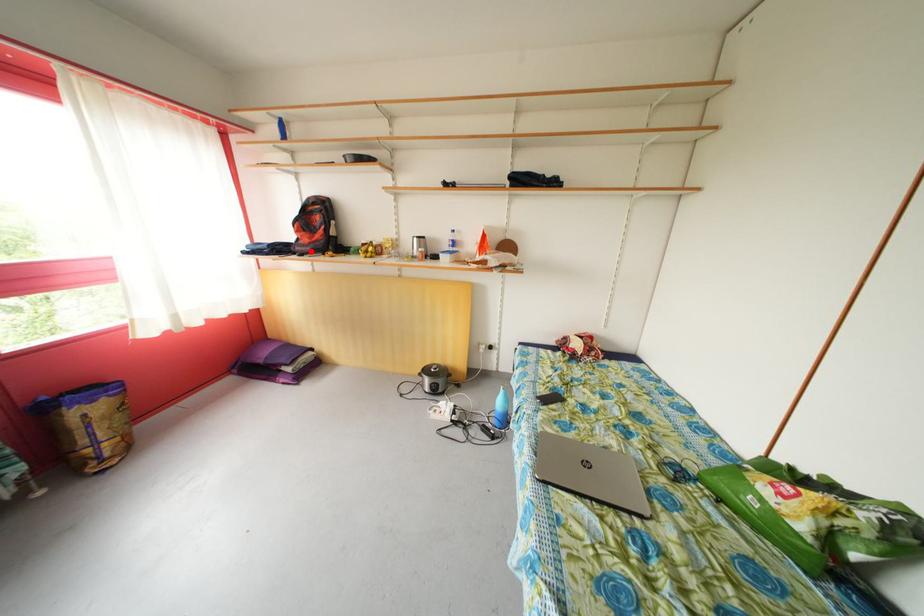
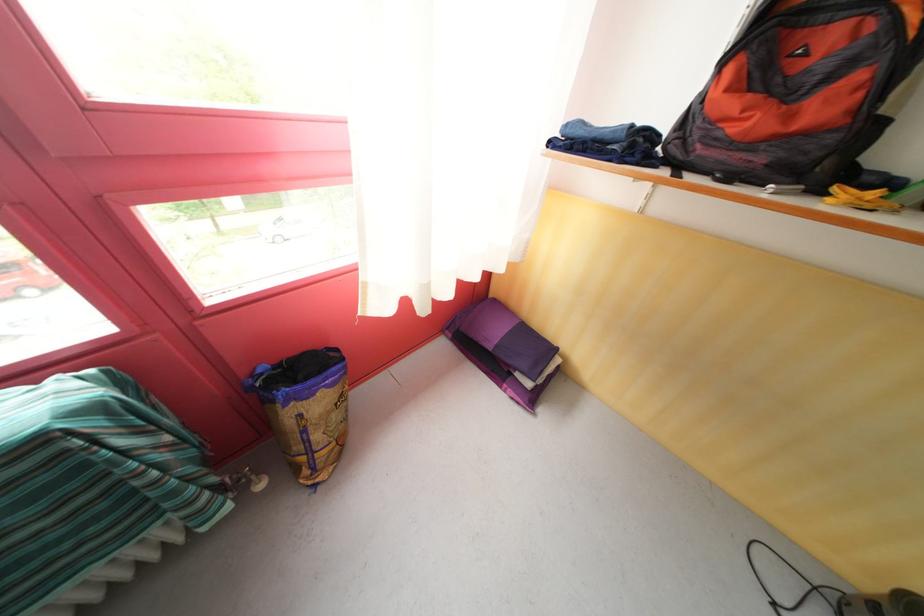
Question: I am providing you with two images of the same scene from different viewpoints. A red point is marked on the first image. Can you still see the location of the red point in image 2?

Choices:
 (A) Yes
 (B) No

Answer: (A)